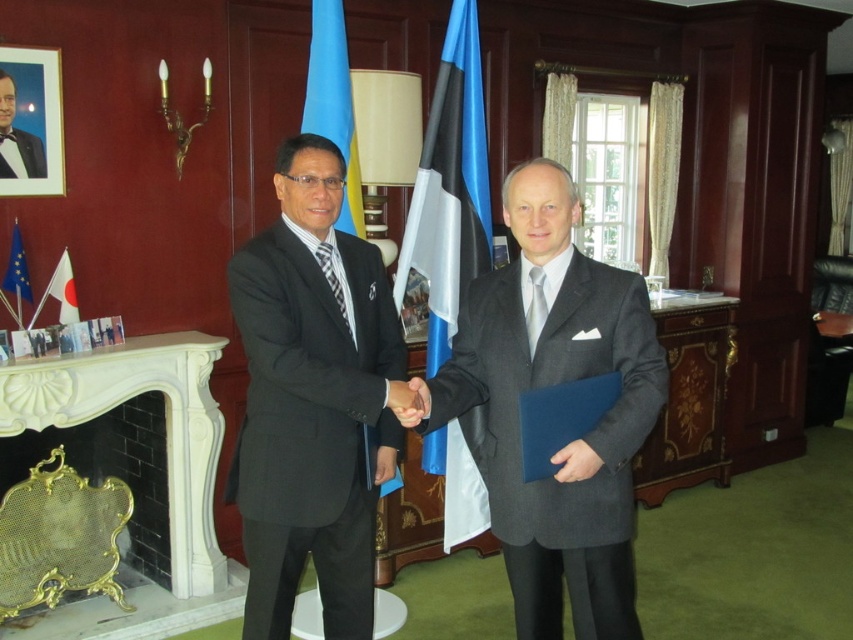
You are standing in the formal meeting room and want to know how far the point at coordinates (473, 104) is from you. Can you determine the distance?

The point at coordinates (473, 104) is 3.04 meters away from you.

You are a security guard in the room. You need to approach the two men shaking hands. If you walk from the entrance door to them, which direction should you turn first? The entrance door is located at the point with coordinates point (x=399, y=259). The two men are standing at the center of the room.

The entrance door is located at point (x=399, y=259). Since the two men are at the center of the room, you should walk straight towards them without turning, as the door is positioned such that the center is directly ahead. However, without specific spatial coordinates for the men, precise direction can only be inferred based on typical room layouts where the center is straight ahead from the entrance.

You are a delivery person who needs to place a 6.5 feet long package between the brushed metal picture frame at upper left and the matte blue folder at center. Can the package fit in the available space?

The distance between the brushed metal picture frame at upper left and the matte blue folder at center is 7.32 feet, which is longer than the 6.5 feet package. Therefore, the package can fit in the available space.